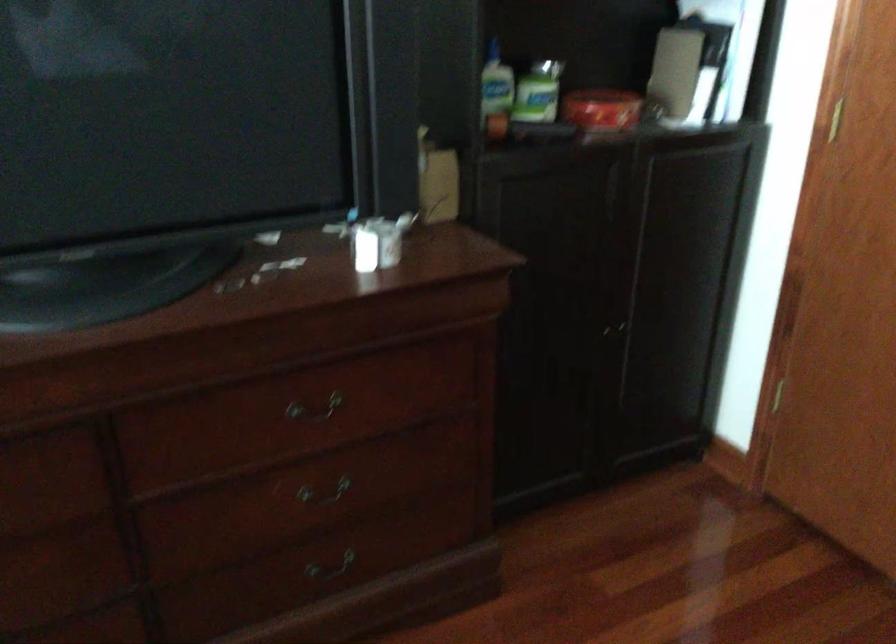
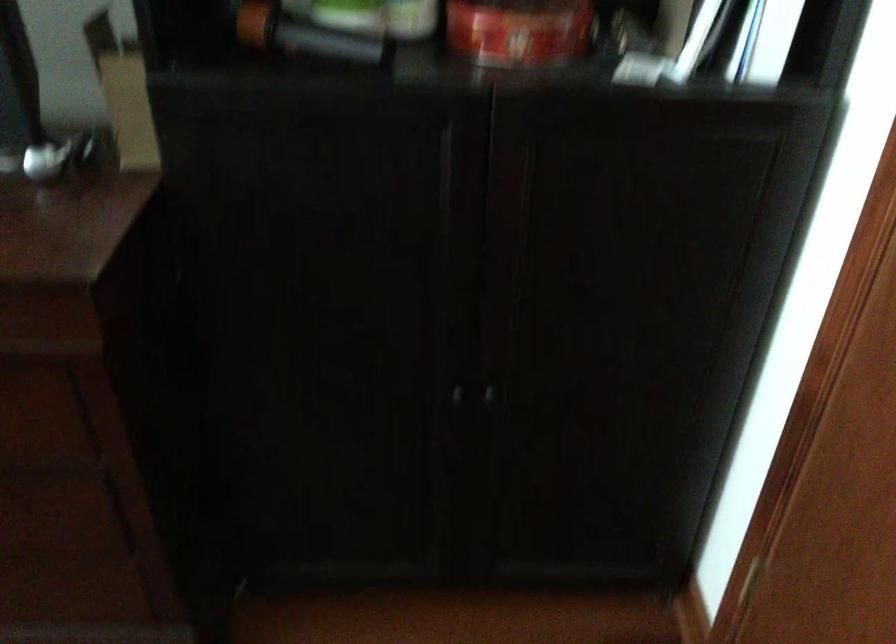
Where in the second image is the point corresponding to (x=618, y=333) from the first image?

(487, 395)